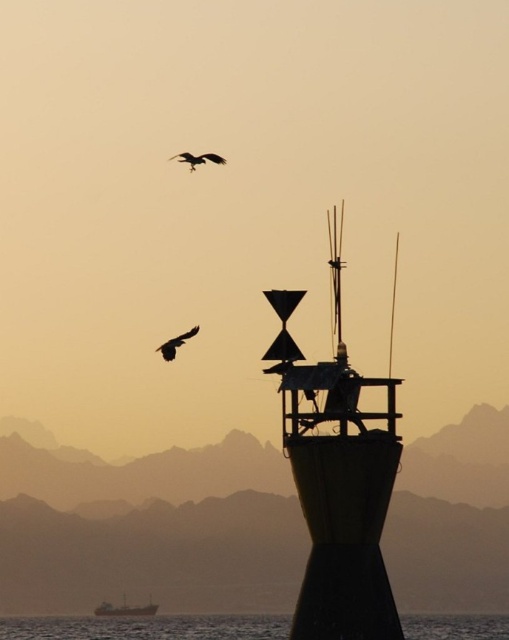
You are standing at the base of the lighthouse in the coastal scene. You notice two points marked in the image. Which point, point (326,397) or point (196,161), is closer to you?

Point (326,397) is closer to the viewer than point (196,161).

You are a birdwatcher observing the scene. You notice the green matte tower at center and the silhouette feathered bird at upper center. Which object appears bigger in the image?

The green matte tower at center appears bigger than the silhouette feathered bird at upper center because it has a larger size.